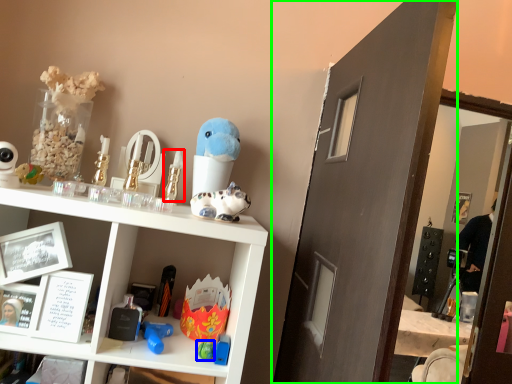
Question: Which is farther away from toy (highlighted by a red box)? toy (highlighted by a blue box) or glass door (highlighted by a green box)?

Choices:
 (A) toy
 (B) glass door

Answer: (B)